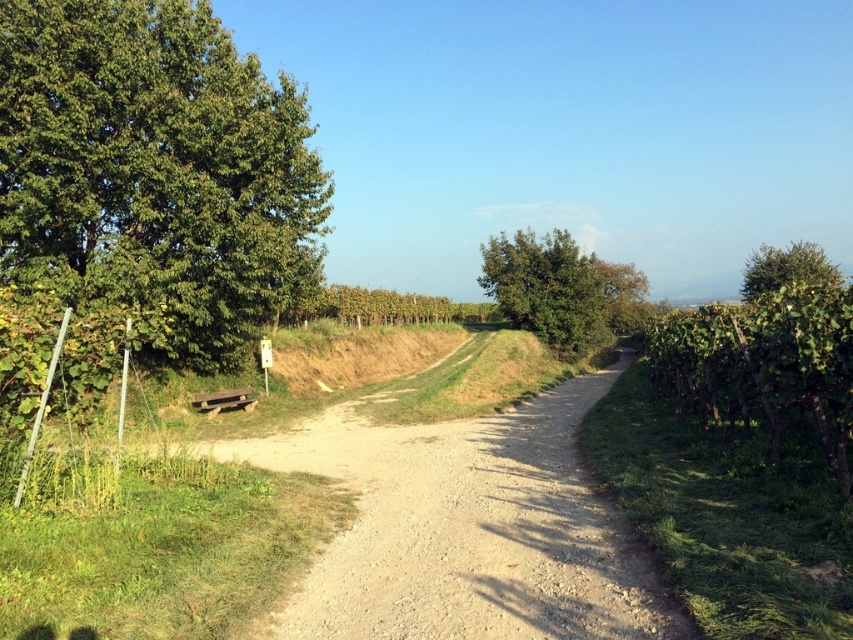
Can you confirm if dusty gravel path at center is shorter than green leafy tree at right?

Yes.

Is dusty gravel path at center wider than green leafy tree at right?

No.

Describe the element at coordinates (469, 529) in the screenshot. I see `dusty gravel path at center` at that location.

Where is `dusty gravel path at center`? Image resolution: width=853 pixels, height=640 pixels. dusty gravel path at center is located at coordinates (469, 529).

Between green leafy tree at left and dusty gravel path at center, which one is positioned higher?

green leafy tree at left is above.

Which is behind, point (143, 1) or point (419, 506)?

Positioned behind is point (143, 1).

Which is in front, point (259, 172) or point (432, 454)?

Point (432, 454)

Where is `green leafy tree at left`? This screenshot has width=853, height=640. green leafy tree at left is located at coordinates (155, 170).

Between green leafy tree at right and green leafy tree at center, which one has less height?

green leafy tree at center

Which is in front, point (753, 348) or point (606, 300)?

Point (753, 348) is in front.

The width and height of the screenshot is (853, 640). What are the coordinates of `green leafy tree at right` in the screenshot? It's located at (769, 353).